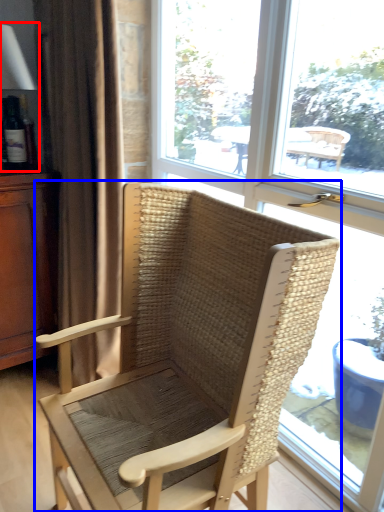
Question: Which object is further to the camera taking this photo, table lamp (highlighted by a red box) or chair (highlighted by a blue box)?

Choices:
 (A) table lamp
 (B) chair

Answer: (A)